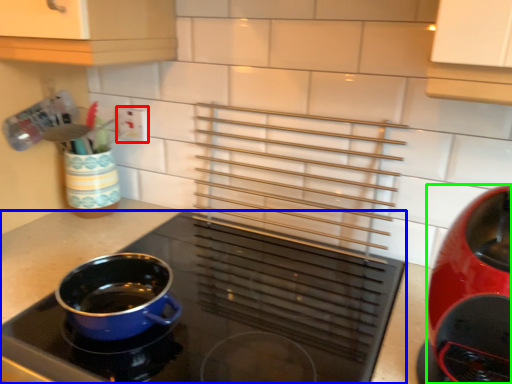
Question: Which object is the farthest from electric outlet (highlighted by a red box)? Choose among these: kitchen appliance (highlighted by a blue box) or kitchen appliance (highlighted by a green box).

Choices:
 (A) kitchen appliance
 (B) kitchen appliance

Answer: (B)